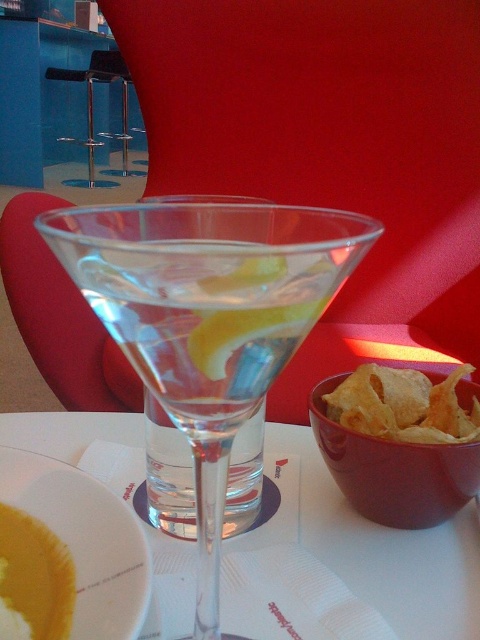
You are a food critic who needs to taste both the soup and the snack. The matte ceramic bowl at lower right contains the snack, and the yellow matte soup at lower left is in a glass. Which container do you need to pick up first to ensure the soup stays warm?

The yellow matte soup at lower left should be picked up first because it is in a glass, which is likely to lose heat faster than the matte ceramic bowl at lower right, which is made of a material that retains heat less effectively. However, since the soup is in the glass, it might not be insulated, so to keep it warm, you should consume it before the snack cools down.

You are at a dinner party and want to reach for the matte ceramic bowl at lower right. However, there is a transparent glass martini at center in the way. Can you move the martini glass to the side to access the bowl?

The transparent glass martini at center is located above the matte ceramic bowl at lower right, so you can move the martini glass to the side to access the bowl.

You are looking at the martini glass and the red bowl on the table. There are two points marked on the tablecloth, one at coordinates point (212, 296) and the other at point (339, 486). Which point is closer to you?

Point (212, 296) is closer to the viewer than point (339, 486).